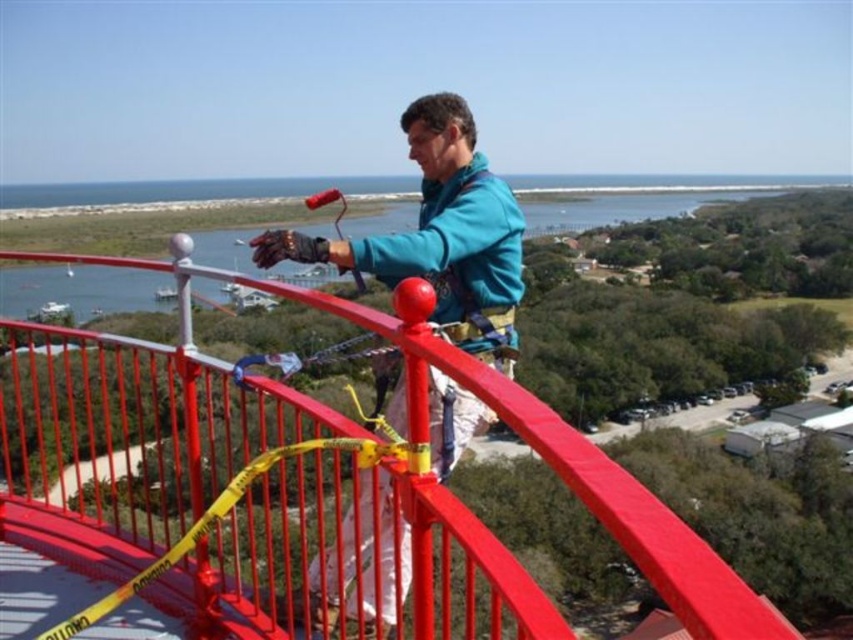
You are a safety inspector reviewing the maintenance work scene. The smooth metal railing at center and the teal fabric jacket at center are visible. Based on their positions, which object is closer to the ground?

The smooth metal railing at center is located below the teal fabric jacket at center, so it is closer to the ground.

You are a safety inspector checking the work area. You notice the smooth metal railing at center and the teal fabric jacket at center. According to the safety protocol, workers must stay at least 1 meter away from the railing during maintenance. Is the worker complying with this rule?

The smooth metal railing at center is to the left of teal fabric jacket at center, meaning the worker is close to the railing. Since the exact distance isn